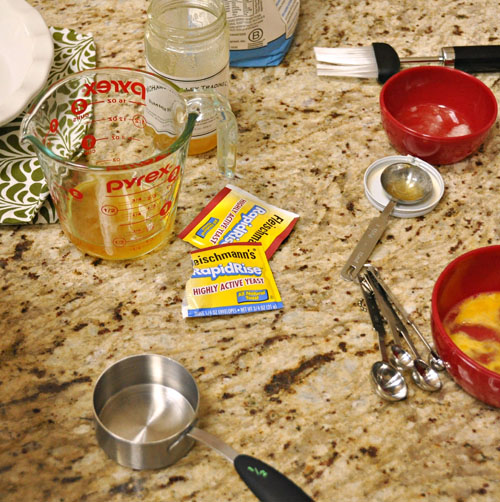
Find the location of `measuring spoons`. measuring spoons is located at coordinates (396, 197), (378, 312), (390, 313), (400, 312).